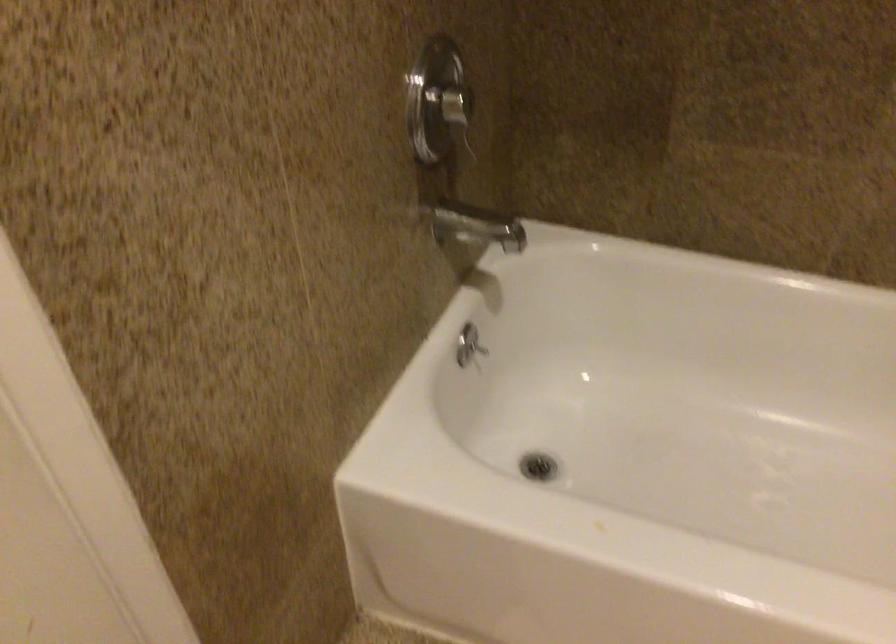
This screenshot has height=644, width=896. Describe the element at coordinates (467, 140) in the screenshot. I see `the chrome shower handle` at that location.